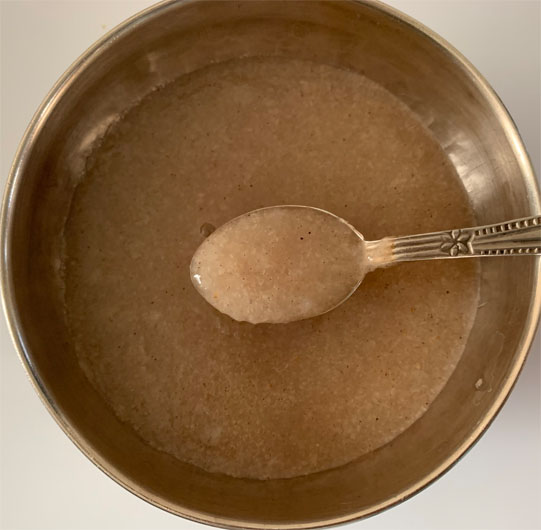
This screenshot has height=530, width=541. What are the coordinates of `metal bowl` in the screenshot? It's located at (464, 149).